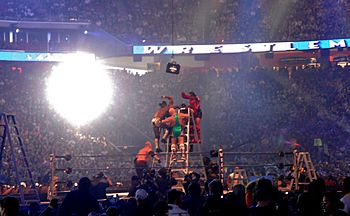
Where is `ladders`? ladders is located at coordinates (188, 143), (306, 160), (19, 183).